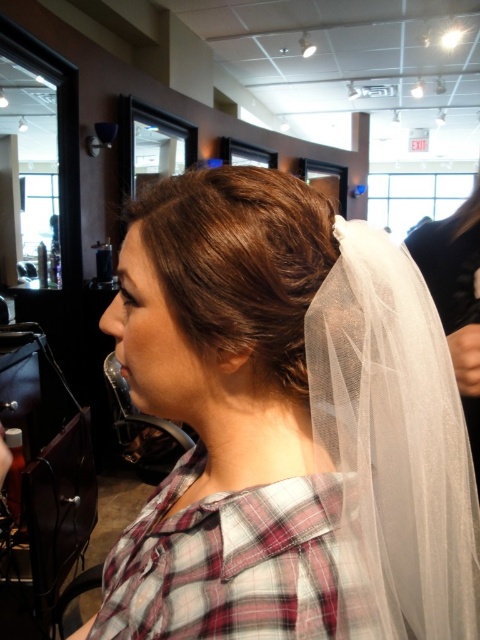
Question: Does white sheer veil at upper center lie behind brown silky hair bun at upper center?

Choices:
 (A) yes
 (B) no

Answer: (B)

Question: Which point is closer to the camera taking this photo?

Choices:
 (A) (360, 483)
 (B) (195, 280)

Answer: (B)

Question: Is white sheer veil at upper center smaller than brown silky hair bun at upper center?

Choices:
 (A) no
 (B) yes

Answer: (A)

Question: Does white sheer veil at upper center appear on the right side of brown silky hair bun at upper center?

Choices:
 (A) yes
 (B) no

Answer: (B)

Question: Which object appears farthest from the camera in this image?

Choices:
 (A) white sheer veil at upper center
 (B) brown silky hair bun at upper center

Answer: (B)